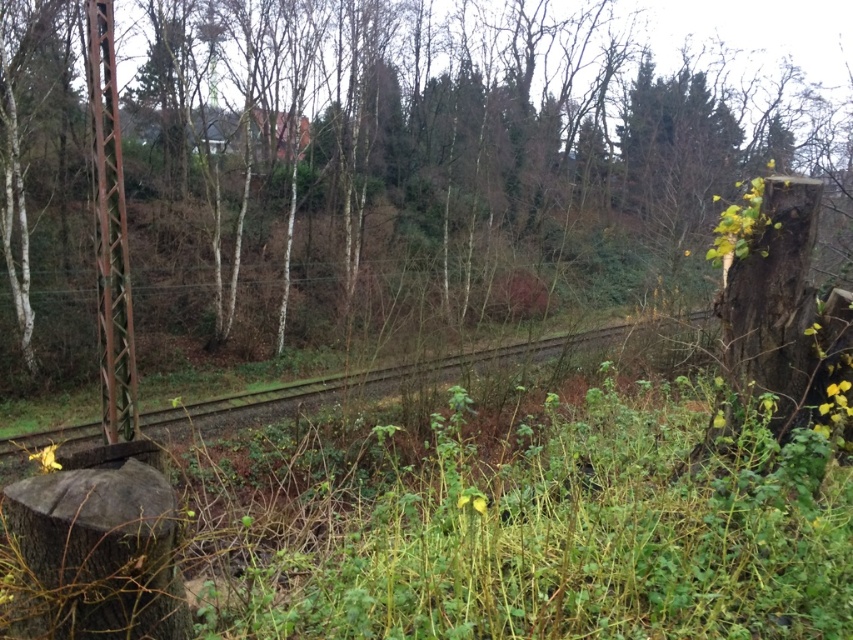
You are a railway inspector checking the railway track. You need to ensure that the brown gravel train track at center is wide enough to accommodate a standard train wheel gauge. Given that the standard gauge is 1.4 meters, and knowing the smooth bark tree stump at left is wider than the track, can you determine if the track is wide enough?

The smooth bark tree stump at left is wider than the brown gravel train track at center. Since the tree stump is wider than the track, and the standard gauge is 1.4 meters, we cannot confirm if the track is wide enough without knowing the exact width of the tree stump.

You are a hiker who has just arrived at the scene. You notice the smooth bark tree stump at left and the brown textured pole at left. Which object is positioned more to the left side of the frame?

The brown textured pole at left is positioned more to the left side of the frame because the smooth bark tree stump at left is to the right of it.